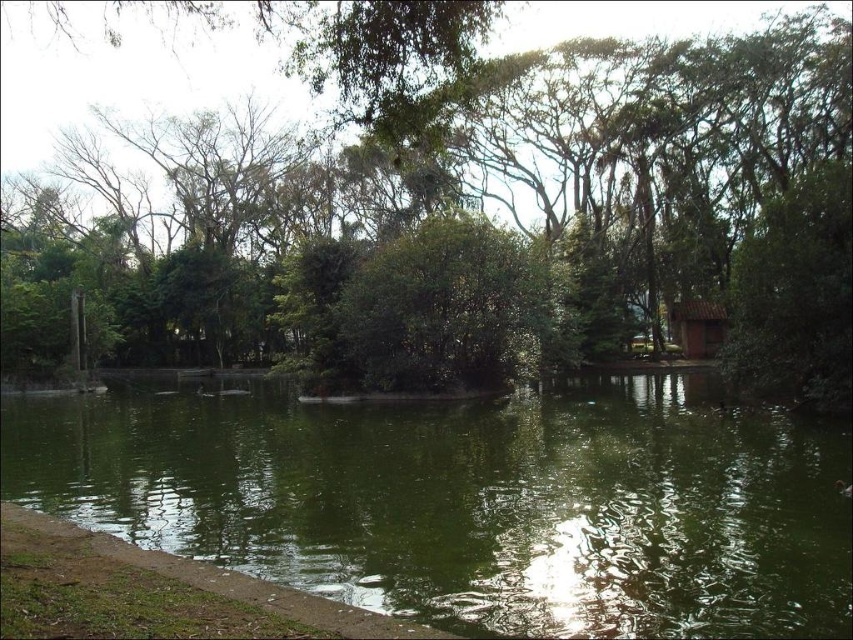
Based on the scene described, which object is positioned to the left of the other between the green leafy tree at center and the green liquid water at center?

The green leafy tree at center is to the left of the green liquid water at center.

You are standing at the point marked by the coordinates point (531,196). Looking towards the green leafy tree at center, which direction should you walk to reach the water?

The point (531,196) is at the green leafy tree at center. To reach the water, you should walk away from the tree towards the edge of the scene where the water is located.

You are standing at the edge of the pond and want to place a small decorative stone. You have two points marked as possible locations for the stone. The first point is at coordinates point (341,113) and the second is at point (285,420). Which point is closer to where you are standing?

Point (341,113) is closer to the viewer than point (285,420), so the first point is closer to where you are standing.